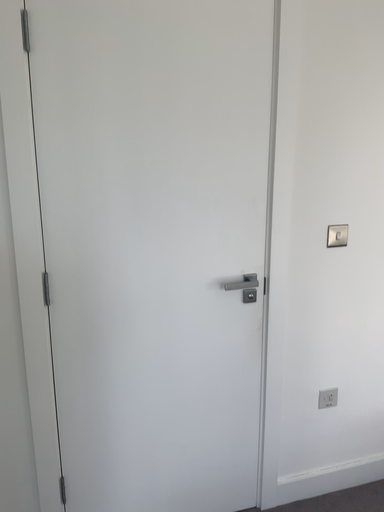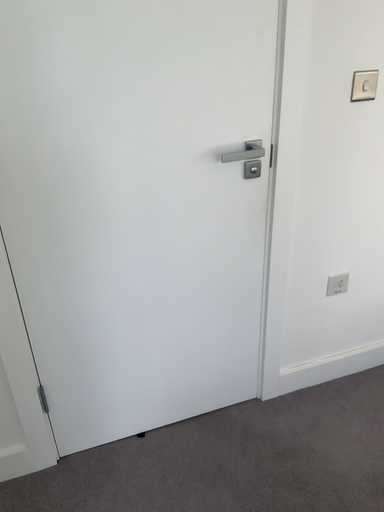
Question: Which way did the camera rotate in the video?

Choices:
 (A) rotated upward
 (B) rotated downward

Answer: (B)